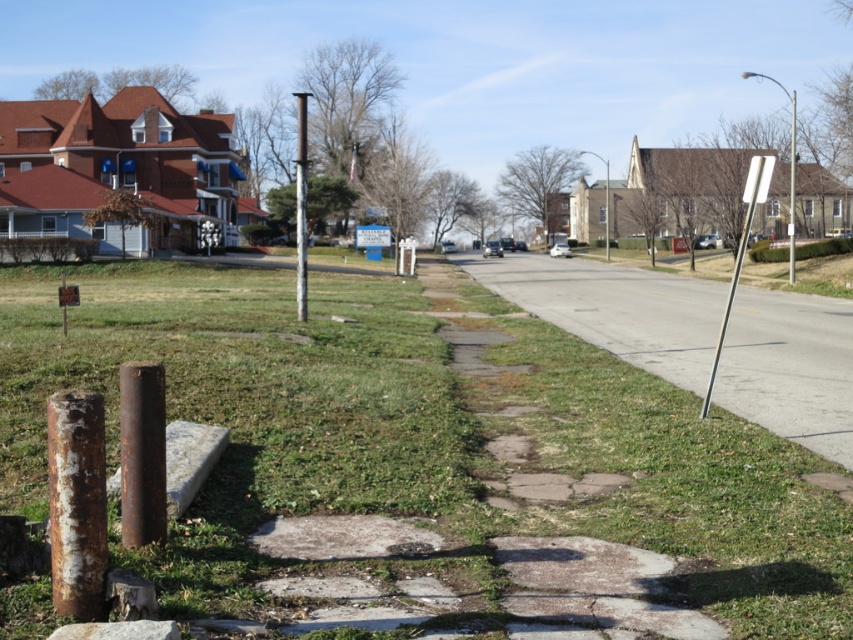
Question: Is green grass at lower center positioned in front of silver metallic signpost at right?

Choices:
 (A) yes
 (B) no

Answer: (A)

Question: Which point appears farthest from the camera in this image?

Choices:
 (A) (502, 289)
 (B) (300, 285)
 (C) (247, 634)

Answer: (A)

Question: Does silver metallic signpost at right lie in front of metallic pole at right?

Choices:
 (A) yes
 (B) no

Answer: (A)

Question: Which object is farther from the camera taking this photo?

Choices:
 (A) gray asphalt road at center
 (B) metallic pole at right
 (C) green grass at lower center

Answer: (B)

Question: Which object is positioned farthest from the rusty metal pole at center?

Choices:
 (A) green grass at lower center
 (B) silver metallic signpost at right
 (C) metallic pole at right
 (D) gray asphalt road at center

Answer: (C)

Question: Does silver metallic signpost at right lie behind rusty metal pole at center?

Choices:
 (A) no
 (B) yes

Answer: (A)